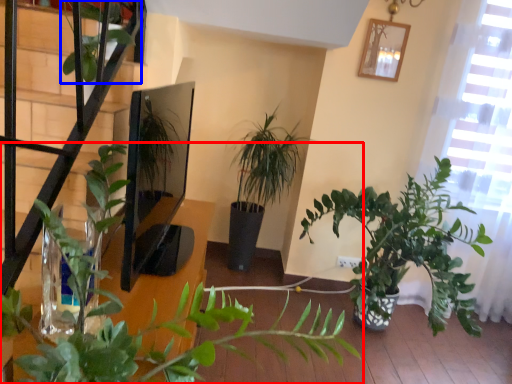
Question: Which point is closer to the camera, houseplant (highlighted by a red box) or vegetation (highlighted by a blue box)?

Choices:
 (A) houseplant
 (B) vegetation

Answer: (A)